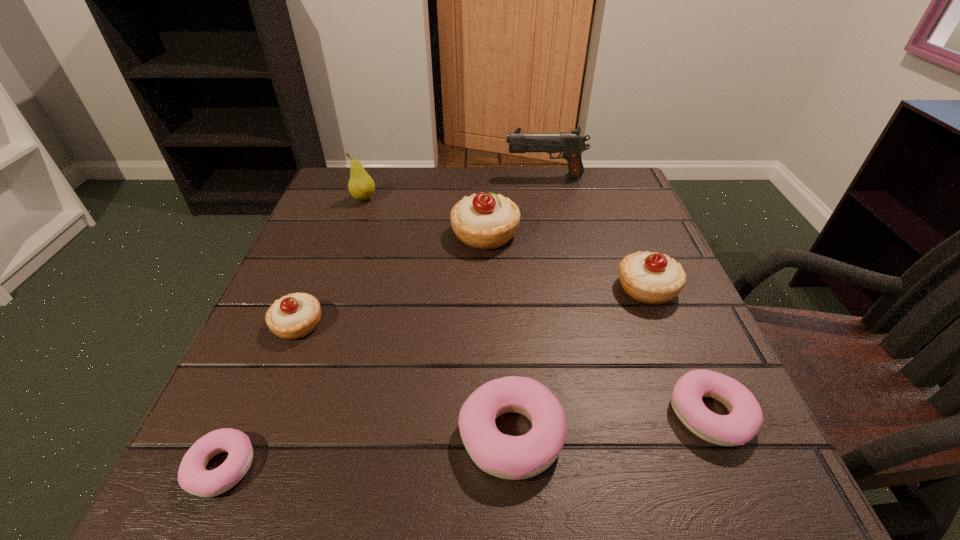
Where is `object that is positioned at the far left corner`? The width and height of the screenshot is (960, 540). object that is positioned at the far left corner is located at coordinates (361, 186).

I want to click on object present at the near left corner, so click(x=193, y=477).

Image resolution: width=960 pixels, height=540 pixels. What are the coordinates of `object situated at the far right corner` in the screenshot? It's located at (571, 144).

Identify the location of object situated at the near right corner. (745, 419).

In the image, there is a desktop. At what (x,y) coordinates should I click in order to perform the action: click on free space at the far edge. Please return your answer as a coordinate pair (x, y). Looking at the image, I should click on coord(452,169).

This screenshot has width=960, height=540. In order to click on vacant region at the near edge of the desktop in this screenshot , I will do `click(416, 500)`.

I want to click on free space at the left edge, so (294, 420).

Locate an element on the screen. This screenshot has height=540, width=960. free point at the right edge is located at coordinates (660, 407).

The height and width of the screenshot is (540, 960). In the image, there is a desktop. What are the coordinates of `blank space at the near left corner` in the screenshot? It's located at (215, 504).

This screenshot has width=960, height=540. In order to click on free spot at the far right corner of the desktop in this screenshot , I will do `click(588, 184)`.